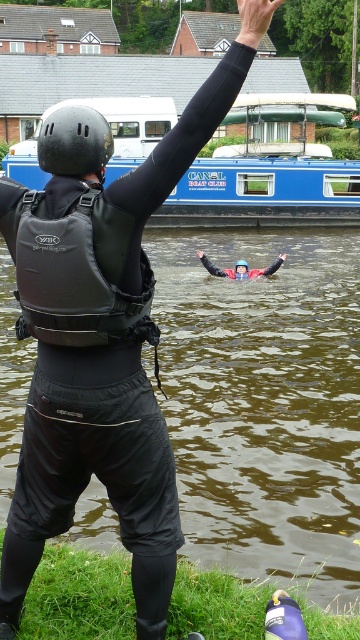
Does red rubber life jacket at center have a smaller size compared to matte black helmet at upper center?

No.

Can you confirm if red rubber life jacket at center is taller than matte black helmet at upper center?

Yes, red rubber life jacket at center is taller than matte black helmet at upper center.

Locate an element on the screen. This screenshot has width=360, height=640. red rubber life jacket at center is located at coordinates (240, 268).

At what (x,y) coordinates should I click in order to perform the action: click on red rubber life jacket at center. Please return your answer as a coordinate pair (x, y). The image size is (360, 640). Looking at the image, I should click on (240, 268).

Which is below, black matte helmet at upper center or red rubber life jacket at center?

black matte helmet at upper center is below.

Is black matte helmet at upper center positioned in front of red rubber life jacket at center?

Yes, it is in front of red rubber life jacket at center.

Locate an element on the screen. The image size is (360, 640). black matte helmet at upper center is located at coordinates (74, 141).

Identify the location of black matte helmet at upper center. The height and width of the screenshot is (640, 360). (74, 141).

Is red rubber life jacket at center to the left of black matte arm at upper center from the viewer's perspective?

Incorrect, red rubber life jacket at center is not on the left side of black matte arm at upper center.

Between point (250, 269) and point (200, 252), which one is positioned in front?

Point (250, 269)

Where is `red rubber life jacket at center`? The height and width of the screenshot is (640, 360). red rubber life jacket at center is located at coordinates (240, 268).